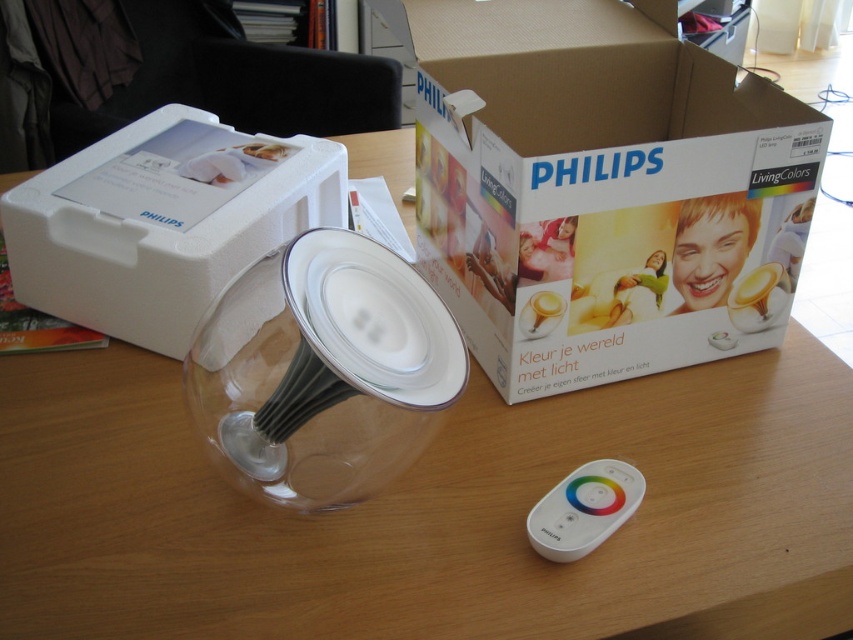
Question: Among these points, which one is nearest to the camera?

Choices:
 (A) (157, 339)
 (B) (418, 109)

Answer: (A)

Question: Which of the following is the closest to the observer?

Choices:
 (A) pyautogui.click(x=589, y=148)
 (B) pyautogui.click(x=234, y=268)
 (C) pyautogui.click(x=566, y=500)

Answer: (C)

Question: Can you confirm if white foam box at upper left is smaller than white plastic remote control at lower center?

Choices:
 (A) no
 (B) yes

Answer: (A)

Question: Is white foam box at upper left in front of white plastic remote control at lower center?

Choices:
 (A) yes
 (B) no

Answer: (B)

Question: Is white cardboard box at center above white foam box at upper left?

Choices:
 (A) yes
 (B) no

Answer: (A)

Question: Which point is farther from the camera taking this photo?

Choices:
 (A) (531, 513)
 (B) (254, 228)

Answer: (B)